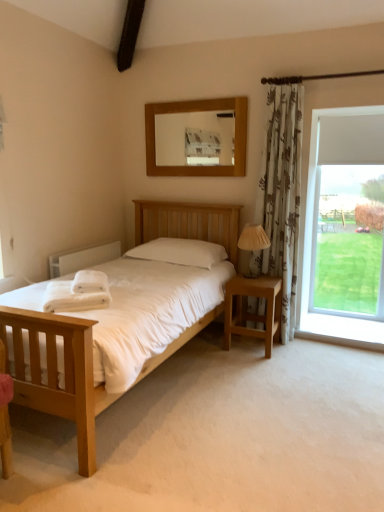
The image size is (384, 512). What are the coordinates of `free space above white soft towel at lower left (from a real-world perspective)` in the screenshot? It's located at (79, 284).